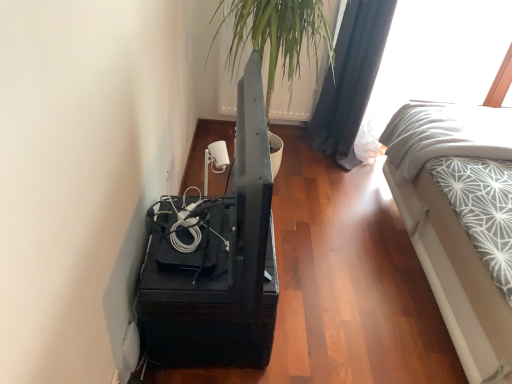
The width and height of the screenshot is (512, 384). Identify the location of unoccupied region to the right of black matte tv stand at lower left. (320, 311).